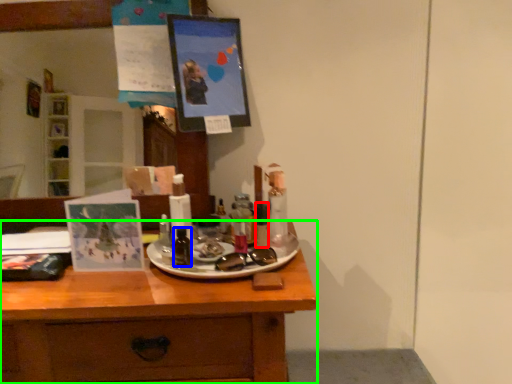
Question: Considering the real-world distances, which object is closest to toiletry (highlighted by a red box)? toiletry (highlighted by a blue box) or desk (highlighted by a green box).

Choices:
 (A) toiletry
 (B) desk

Answer: (A)